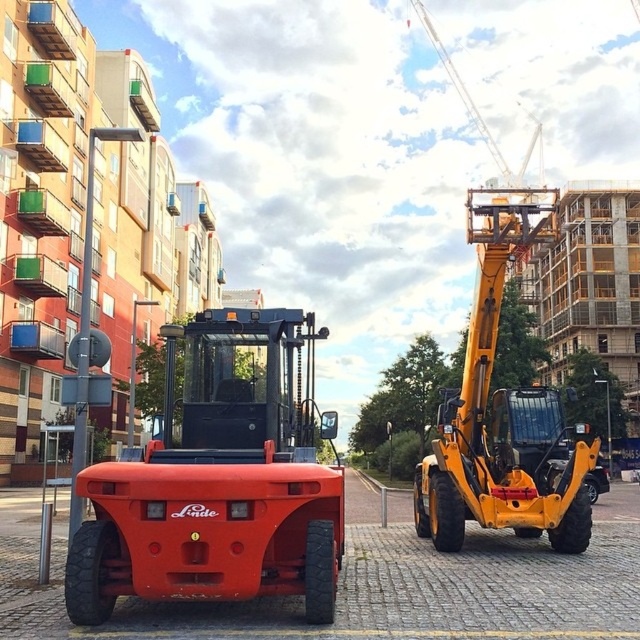
Is matte orange tractor at center smaller than yellow metallic excavator at right?

Result: Indeed, matte orange tractor at center has a smaller size compared to yellow metallic excavator at right.

Does matte orange tractor at center appear on the right side of yellow metallic excavator at right?

Incorrect, matte orange tractor at center is not on the right side of yellow metallic excavator at right.

Does point (310, 404) lie in front of point (486, 433)?

Yes, it is.

The height and width of the screenshot is (640, 640). I want to click on matte orange tractor at center, so click(x=218, y=483).